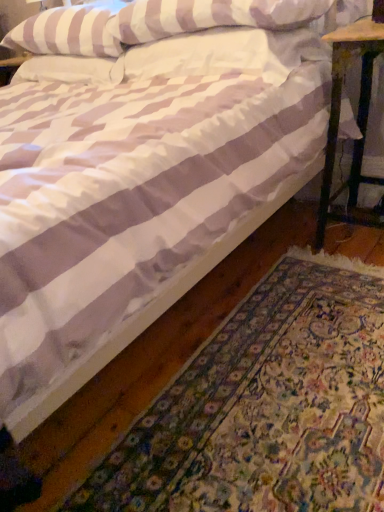
In order to click on white striped pillow at upper left, arranged as the 1th pillow when viewed from the left in this screenshot , I will do `click(67, 32)`.

This screenshot has height=512, width=384. What do you see at coordinates (223, 54) in the screenshot?
I see `white striped pillow at upper center, placed as the 3th pillow when sorted from left to right` at bounding box center [223, 54].

This screenshot has width=384, height=512. I want to click on white striped pillow at upper center, placed as the 2th pillow when sorted from right to left, so click(209, 17).

The image size is (384, 512). In order to click on white striped pillow at upper left, the third pillow from the right in this screenshot , I will do `click(67, 32)`.

Based on the photo, considering the sizes of objects white striped pillow at upper left, arranged as the 1th pillow when viewed from the left, and white striped pillow at upper center, which is the first pillow from right to left, in the image provided, who is smaller, white striped pillow at upper left, arranged as the 1th pillow when viewed from the left, or white striped pillow at upper center, which is the first pillow from right to left,?

With smaller size is white striped pillow at upper center, which is the first pillow from right to left.

There is a white striped pillow at upper left, the third pillow from the right. At what (x,y) coordinates should I click in order to perform the action: click on the 2nd pillow below it (from the image's perspective). Please return your answer as a coordinate pair (x, y). The height and width of the screenshot is (512, 384). Looking at the image, I should click on (223, 54).

Could you tell me if white striped pillow at upper left, the third pillow from the right, is facing white striped pillow at upper center, which is the first pillow from right to left?

No, white striped pillow at upper left, the third pillow from the right, is not facing towards white striped pillow at upper center, which is the first pillow from right to left.

Are white striped pillow at upper left, arranged as the 1th pillow when viewed from the left, and white striped pillow at upper center, placed as the 3th pillow when sorted from left to right, beside each other?

white striped pillow at upper left, arranged as the 1th pillow when viewed from the left, and white striped pillow at upper center, placed as the 3th pillow when sorted from left to right, are clearly separated.

From the image's perspective, which one is positioned lower, white striped pillow at upper center, arranged as the 2th pillow when viewed from the left, or wooden stool at right?

From the image's view, wooden stool at right is below.

Is white striped pillow at upper center, placed as the 2th pillow when sorted from right to left, situated inside wooden stool at right or outside?

white striped pillow at upper center, placed as the 2th pillow when sorted from right to left, is not enclosed by wooden stool at right.

Who is taller, white striped pillow at upper center, arranged as the 2th pillow when viewed from the left, or wooden stool at right?

Standing taller between the two is wooden stool at right.

In the scene shown: Is white striped pillow at upper center, arranged as the 2th pillow when viewed from the left, placed right next to wooden stool at right?

No, white striped pillow at upper center, arranged as the 2th pillow when viewed from the left, is not making contact with wooden stool at right.

Which object is closer to the camera, white striped pillow at upper left, the third pillow from the right, or white textured rug at lower right?

white textured rug at lower right is closer to the camera.

Which is in front, point (98, 27) or point (202, 454)?

Positioned in front is point (202, 454).

Consider the image. From the image's perspective, is white striped pillow at upper left, the third pillow from the right, under white textured rug at lower right?

Incorrect, from the image's perspective, white striped pillow at upper left, the third pillow from the right, is higher than white textured rug at lower right.

Which is further, (233, 488) or (233, 51)?

The point (233, 51) is farther from the camera.

Where is `mat located below the white striped pillow at upper center, which is the first pillow from right to left (from the image's perspective)`? The width and height of the screenshot is (384, 512). mat located below the white striped pillow at upper center, which is the first pillow from right to left (from the image's perspective) is located at coordinates (265, 407).

Which of these two, white textured rug at lower right or white striped pillow at upper center, which is the first pillow from right to left, is thinner?

white striped pillow at upper center, which is the first pillow from right to left.

From the image's perspective, between white textured rug at lower right and white striped pillow at upper center, which is the first pillow from right to left, which one is located above?

white striped pillow at upper center, which is the first pillow from right to left, from the image's perspective.

Are white textured rug at lower right and white striped pillow at upper left, the third pillow from the right, making contact?

No, white textured rug at lower right is not beside white striped pillow at upper left, the third pillow from the right.

From the image's perspective, is white textured rug at lower right over white striped pillow at upper left, the third pillow from the right?

No, from the image's perspective, white textured rug at lower right is not over white striped pillow at upper left, the third pillow from the right.

Is white textured rug at lower right at the left side of white striped pillow at upper left, arranged as the 1th pillow when viewed from the left?

No, white textured rug at lower right is not to the left of white striped pillow at upper left, arranged as the 1th pillow when viewed from the left.

Is point (226, 366) in front of point (30, 24)?

Yes, it is in front of point (30, 24).

From a real-world perspective, which object stands above the other?

white striped pillow at upper center, which is the first pillow from right to left, from a real-world perspective.

From the image's perspective, which one is positioned higher, white striped pillow at upper center, which is the first pillow from right to left, or white textured rug at lower right?

white striped pillow at upper center, which is the first pillow from right to left.

Is white striped pillow at upper center, placed as the 3th pillow when sorted from left to right, beside white textured rug at lower right?

They are not placed beside each other.

Considering the relative sizes of white striped pillow at upper center, which is the first pillow from right to left, and white textured rug at lower right in the image provided, is white striped pillow at upper center, which is the first pillow from right to left, thinner than white textured rug at lower right?

Indeed, white striped pillow at upper center, which is the first pillow from right to left, has a lesser width compared to white textured rug at lower right.

Does white textured rug at lower right come in front of white striped pillow at upper center, arranged as the 2th pillow when viewed from the left?

Yes, white textured rug at lower right is in front of white striped pillow at upper center, arranged as the 2th pillow when viewed from the left.

Is white textured rug at lower right oriented away from white striped pillow at upper center, placed as the 2th pillow when sorted from right to left?

That's not correct — white textured rug at lower right is not looking away from white striped pillow at upper center, placed as the 2th pillow when sorted from right to left.

Does white textured rug at lower right have a greater width compared to white striped pillow at upper center, placed as the 2th pillow when sorted from right to left?

Correct, the width of white textured rug at lower right exceeds that of white striped pillow at upper center, placed as the 2th pillow when sorted from right to left.

Identify the location of the 1st pillow in front when counting from the white striped pillow at upper left, the third pillow from the right. The image size is (384, 512). (223, 54).

I want to click on table below the white striped pillow at upper center, placed as the 2th pillow when sorted from right to left (from the image's perspective), so click(x=357, y=122).

From the image, which object appears to be farther from white striped pillow at upper center, placed as the 3th pillow when sorted from left to right, wooden stool at right or white striped pillow at upper left, arranged as the 1th pillow when viewed from the left?

white striped pillow at upper left, arranged as the 1th pillow when viewed from the left, lies further to white striped pillow at upper center, placed as the 3th pillow when sorted from left to right, than the other object.

Looking at the image, which one is located closer to white striped pillow at upper center, arranged as the 2th pillow when viewed from the left, wooden stool at right or white striped pillow at upper center, placed as the 3th pillow when sorted from left to right?

white striped pillow at upper center, placed as the 3th pillow when sorted from left to right, is positioned closer to the anchor white striped pillow at upper center, arranged as the 2th pillow when viewed from the left.

Considering their positions, is wooden stool at right positioned further to white striped pillow at upper left, the third pillow from the right, than white textured rug at lower right?

white textured rug at lower right lies further to white striped pillow at upper left, the third pillow from the right, than the other object.

Estimate the real-world distances between objects in this image. Which object is closer to white striped pillow at upper left, arranged as the 1th pillow when viewed from the left, white textured rug at lower right or white striped pillow at upper center, placed as the 2th pillow when sorted from right to left?

The object closer to white striped pillow at upper left, arranged as the 1th pillow when viewed from the left, is white striped pillow at upper center, placed as the 2th pillow when sorted from right to left.

Considering their positions, is wooden stool at right positioned further to white striped pillow at upper center, placed as the 3th pillow when sorted from left to right, than white textured rug at lower right?

Among the two, white textured rug at lower right is located further to white striped pillow at upper center, placed as the 3th pillow when sorted from left to right.

Based on their spatial positions, is white textured rug at lower right or white striped pillow at upper left, the third pillow from the right, further from white striped pillow at upper center, arranged as the 2th pillow when viewed from the left?

white textured rug at lower right is further to white striped pillow at upper center, arranged as the 2th pillow when viewed from the left.

Which object lies further to the anchor point white striped pillow at upper center, arranged as the 2th pillow when viewed from the left, white textured rug at lower right or white striped pillow at upper center, which is the first pillow from right to left?

Based on the image, white textured rug at lower right appears to be further to white striped pillow at upper center, arranged as the 2th pillow when viewed from the left.

Based on their spatial positions, is white striped pillow at upper center, arranged as the 2th pillow when viewed from the left, or white striped pillow at upper center, which is the first pillow from right to left, further from wooden stool at right?

The object further to wooden stool at right is white striped pillow at upper center, arranged as the 2th pillow when viewed from the left.

Find the location of `mat between white striped pillow at upper left, the third pillow from the right, and wooden stool at right`. mat between white striped pillow at upper left, the third pillow from the right, and wooden stool at right is located at coordinates (265, 407).

I want to click on table between white striped pillow at upper center, arranged as the 2th pillow when viewed from the left, and white textured rug at lower right vertically, so click(x=357, y=122).

Find the location of a particular element. pillow between white striped pillow at upper left, the third pillow from the right, and white striped pillow at upper center, which is the first pillow from right to left, in the horizontal direction is located at coordinates (209, 17).

Find the location of a particular element. Image resolution: width=384 pixels, height=512 pixels. pillow between white striped pillow at upper center, arranged as the 2th pillow when viewed from the left, and wooden stool at right is located at coordinates (223, 54).